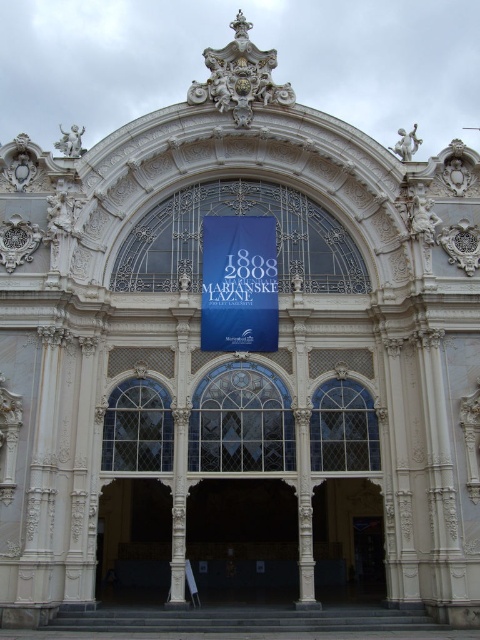
You are standing in front of the grand building and want to take a photo of the white stone archway at center without the blue fabric banner at center appearing in the shot. Is this possible given their positions?

The blue fabric banner at center is above the white stone archway at center, so it would block the view of the archway. Therefore, it is not possible to take a photo of the white stone archway at center without the blue fabric banner at center appearing in the shot.

You are standing in front of the grand building and want to take a photo. You notice two points marked on the facade. The first point is at coordinate point (276, 339) and the second is at point (371, 576). Which point is closer to you?

Point (276, 339) is closer to the viewer than point (371, 576).